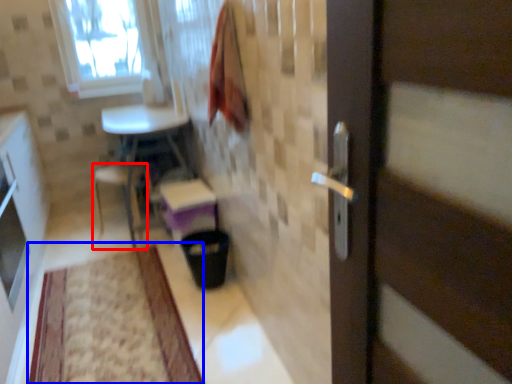
Question: Which of the following is the farthest to the observer, chair (highlighted by a red box) or mat (highlighted by a blue box)?

Choices:
 (A) chair
 (B) mat

Answer: (A)